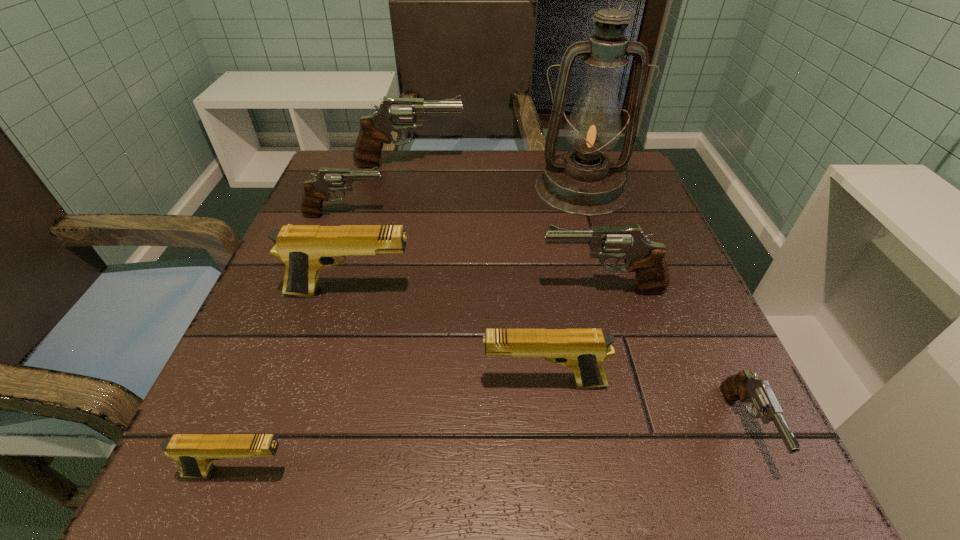
This screenshot has width=960, height=540. Find the location of `the rightmost pistol`. the rightmost pistol is located at coordinates (743, 386).

The image size is (960, 540). Find the location of `the rightmost gray pistol`. the rightmost gray pistol is located at coordinates (743, 386).

Find the location of a particular element. the nearest tan pistol is located at coordinates (195, 453).

You are a GUI agent. You are given a task and a screenshot of the screen. Output one action in this format:
    pyautogui.click(x=<x>, y=<y>)
    Task: Click on the free space located 0.290m on the left of the tallest object
    
    Given the screenshot: What is the action you would take?
    pyautogui.click(x=410, y=188)

The image size is (960, 540). What are the coordinates of `free space located at the barrel of the farthest gray pistol` in the screenshot? It's located at (573, 165).

Image resolution: width=960 pixels, height=540 pixels. I want to click on blank space located 0.190m at the barrel of the second biggest gray pistol, so coord(432,289).

Find the location of a particular element. The image size is (960, 540). free point located at the barrel of the second biggest gray pistol is located at coordinates (420, 289).

The height and width of the screenshot is (540, 960). Identify the location of free region located 0.080m at the barrel of the second biggest gray pistol. (494, 289).

You are a GUI agent. You are given a task and a screenshot of the screen. Output one action in this format:
    pyautogui.click(x=<x>, y=<y>)
    Task: Click on the vacant region located 0.050m at the barrel of the farthest tan pistol
    
    Given the screenshot: What is the action you would take?
    pyautogui.click(x=442, y=292)

Where is `vacant space situated at the barrel of the second farthest pistol`? This screenshot has width=960, height=540. vacant space situated at the barrel of the second farthest pistol is located at coordinates (490, 215).